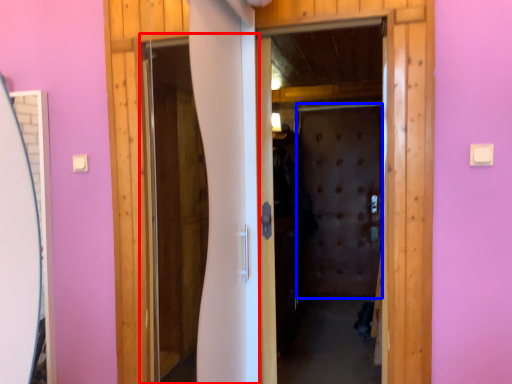
Question: Which object appears farthest to the camera in this image, screen door (highlighted by a red box) or screen door (highlighted by a blue box)?

Choices:
 (A) screen door
 (B) screen door

Answer: (B)